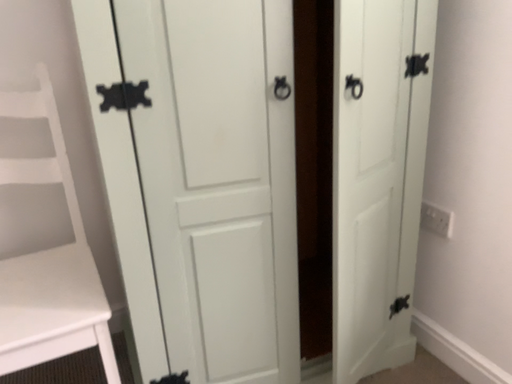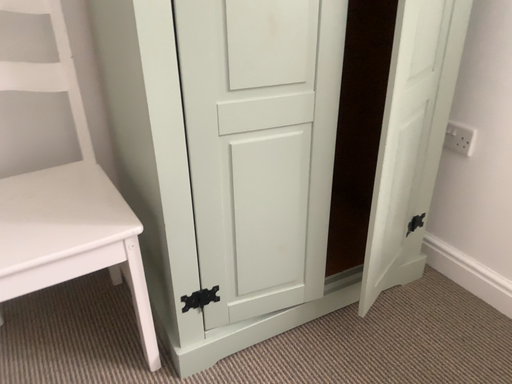
Question: Which way did the camera rotate in the video?

Choices:
 (A) rotated downward
 (B) rotated upward

Answer: (A)